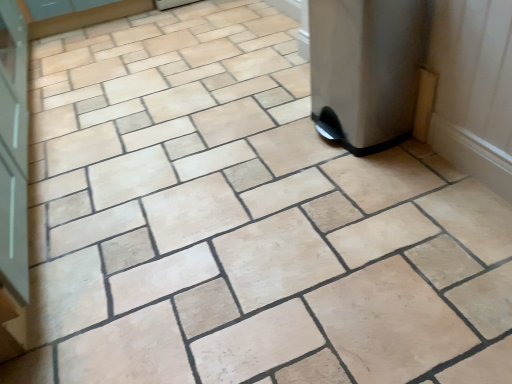
I want to click on metallic trash can at right, so click(369, 70).

The image size is (512, 384). What do you see at coordinates (369, 70) in the screenshot?
I see `metallic trash can at right` at bounding box center [369, 70].

Identify the location of metallic trash can at right. (369, 70).